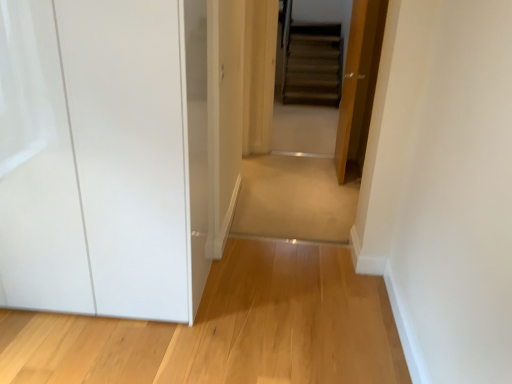
Locate an element on the screen. Image resolution: width=512 pixels, height=384 pixels. free space underneath wooden door at center (from a real-world perspective) is located at coordinates (334, 171).